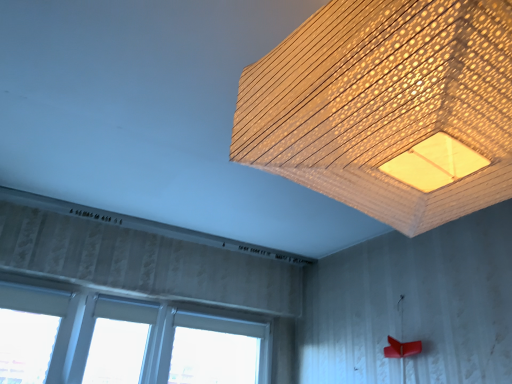
In order to face wooden textured lampshade at upper center, should I rotate leftwards or rightwards?

To face it directly, rotate right by 20.236 degrees.

What is the approximate height of wooden textured lampshade at upper center?

wooden textured lampshade at upper center is 22.54 inches tall.

Measure the distance between wooden textured lampshade at upper center and camera.

They are 19.96 inches apart.

Find the location of `wooden textured lampshade at upper center`. wooden textured lampshade at upper center is located at coordinates (388, 108).

This screenshot has width=512, height=384. What do you see at coordinates (388, 108) in the screenshot?
I see `wooden textured lampshade at upper center` at bounding box center [388, 108].

Describe the element at coordinates (124, 340) in the screenshot. I see `white plastic window at lower left` at that location.

Locate an element on the screen. The width and height of the screenshot is (512, 384). white plastic window at lower left is located at coordinates (124, 340).

The width and height of the screenshot is (512, 384). Identify the location of wooden textured lampshade at upper center. (388, 108).

Which object is positioned more to the left, wooden textured lampshade at upper center or white plastic window at lower left?

From the viewer's perspective, white plastic window at lower left appears more on the left side.

Consider the image. Is the depth of wooden textured lampshade at upper center less than that of white plastic window at lower left?

Yes.

Is point (385, 114) closer or farther from the camera than point (62, 348)?

Point (385, 114).

From the image's perspective, between wooden textured lampshade at upper center and white plastic window at lower left, which one is located above?

From the image's view, wooden textured lampshade at upper center is above.

From a real-world perspective, who is located higher, wooden textured lampshade at upper center or white plastic window at lower left?

wooden textured lampshade at upper center is physically above.

Consider the image. Between wooden textured lampshade at upper center and white plastic window at lower left, which one has larger width?

Wider between the two is wooden textured lampshade at upper center.

Who is shorter, wooden textured lampshade at upper center or white plastic window at lower left?

wooden textured lampshade at upper center.

Based on the photo, considering the sizes of objects wooden textured lampshade at upper center and white plastic window at lower left in the image provided, who is smaller, wooden textured lampshade at upper center or white plastic window at lower left?

Smaller between the two is white plastic window at lower left.

Is wooden textured lampshade at upper center not inside white plastic window at lower left?

wooden textured lampshade at upper center lies outside white plastic window at lower left's area.

From the picture: Is wooden textured lampshade at upper center with white plastic window at lower left?

No, wooden textured lampshade at upper center is not making contact with white plastic window at lower left.

Does wooden textured lampshade at upper center turn towards white plastic window at lower left?

No, wooden textured lampshade at upper center is not aimed at white plastic window at lower left.

Measure the distance between wooden textured lampshade at upper center and white plastic window at lower left.

Result: wooden textured lampshade at upper center is 7.31 feet away from white plastic window at lower left.

Locate an element on the screen. This screenshot has height=384, width=512. lamp on the right of white plastic window at lower left is located at coordinates (388, 108).

Considering the positions of objects white plastic window at lower left and wooden textured lampshade at upper center in the image provided, who is more to the left, white plastic window at lower left or wooden textured lampshade at upper center?

Positioned to the left is white plastic window at lower left.

In the scene shown: Is white plastic window at lower left behind wooden textured lampshade at upper center?

Yes, white plastic window at lower left is further from the camera.

Which is nearer, [103,345] or [402,70]?

Point [103,345] is positioned farther from the camera compared to point [402,70].

From the image's perspective, is white plastic window at lower left over wooden textured lampshade at upper center?

No, from the image's perspective, white plastic window at lower left is not over wooden textured lampshade at upper center.

From a real-world perspective, is white plastic window at lower left positioned over wooden textured lampshade at upper center based on gravity?

No, from a real-world perspective, white plastic window at lower left is not on top of wooden textured lampshade at upper center.

Considering the sizes of objects white plastic window at lower left and wooden textured lampshade at upper center in the image provided, who is thinner, white plastic window at lower left or wooden textured lampshade at upper center?

With smaller width is white plastic window at lower left.

Is white plastic window at lower left shorter than wooden textured lampshade at upper center?

In fact, white plastic window at lower left may be taller than wooden textured lampshade at upper center.

Between white plastic window at lower left and wooden textured lampshade at upper center, which one has larger size?

With larger size is wooden textured lampshade at upper center.

Would you say white plastic window at lower left contains wooden textured lampshade at upper center?

No, wooden textured lampshade at upper center is not surrounded by white plastic window at lower left.

Consider the image. Is white plastic window at lower left next to wooden textured lampshade at upper center and touching it?

No.

Is white plastic window at lower left looking in the opposite direction of wooden textured lampshade at upper center?

That's not correct — white plastic window at lower left is not looking away from wooden textured lampshade at upper center.

In order to click on lamp on the right side of white plastic window at lower left in this screenshot , I will do `click(388, 108)`.

This screenshot has height=384, width=512. What are the coordinates of `window that is behind the wooden textured lampshade at upper center` in the screenshot? It's located at (124, 340).

The image size is (512, 384). Identify the location of lamp that appears on the right of white plastic window at lower left. (388, 108).